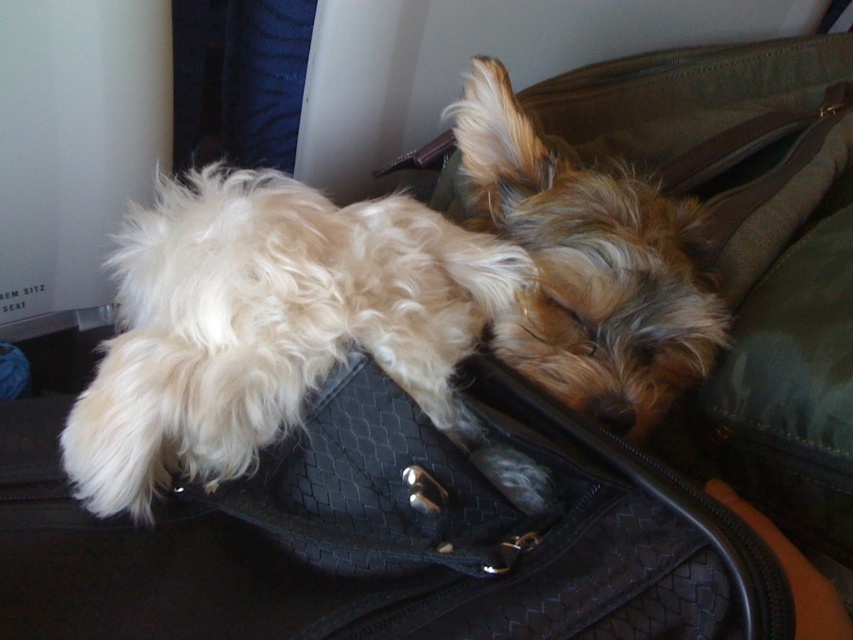
Between white fluffy dog at center and fuzzy brown dog at center, which one appears on the right side from the viewer's perspective?

fuzzy brown dog at center is more to the right.

Does point (148, 296) come farther from viewer compared to point (468, 193)?

No, (148, 296) is in front of (468, 193).

Is point (402, 356) positioned behind point (486, 182)?

No, it is not.

Identify the location of white fluffy dog at center. The width and height of the screenshot is (853, 640). (276, 328).